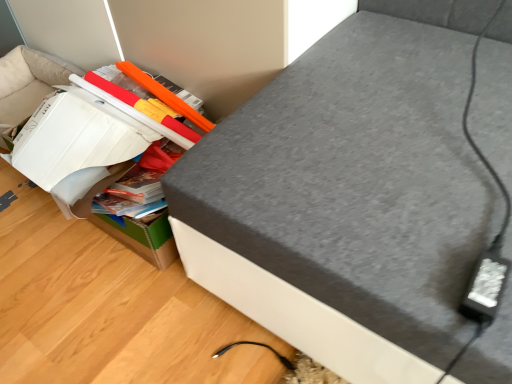
This screenshot has width=512, height=384. Find the location of `cardboard box at lower left`. cardboard box at lower left is located at coordinates (133, 225).

What do you see at coordinates (133, 225) in the screenshot? The image size is (512, 384). I see `cardboard box at lower left` at bounding box center [133, 225].

The image size is (512, 384). Describe the element at coordinates (350, 195) in the screenshot. I see `grey fabric ottoman at upper right` at that location.

Locate an element on the screen. This screenshot has height=384, width=512. grey fabric ottoman at upper right is located at coordinates (350, 195).

What is the approximate width of grey fabric ottoman at upper right?

It is 35.78 inches.

What are the coordinates of `cardboard box at lower left` in the screenshot? It's located at (133, 225).

Which is more to the right, cardboard box at lower left or grey fabric ottoman at upper right?

Positioned to the right is grey fabric ottoman at upper right.

Between cardboard box at lower left and grey fabric ottoman at upper right, which one is positioned behind?

Positioned behind is cardboard box at lower left.

Which is farther from the camera, (143,234) or (391,230)?

Point (143,234)

Consider the image. From the image's perspective, which is below, cardboard box at lower left or grey fabric ottoman at upper right?

cardboard box at lower left, from the image's perspective.

From a real-world perspective, is cardboard box at lower left above or below grey fabric ottoman at upper right?

From a real-world perspective, cardboard box at lower left is physically below grey fabric ottoman at upper right.

Does cardboard box at lower left have a greater width compared to grey fabric ottoman at upper right?

Incorrect, the width of cardboard box at lower left does not surpass that of grey fabric ottoman at upper right.

Does cardboard box at lower left have a lesser height compared to grey fabric ottoman at upper right?

Indeed, cardboard box at lower left has a lesser height compared to grey fabric ottoman at upper right.

Is cardboard box at lower left bigger than grey fabric ottoman at upper right?

Actually, cardboard box at lower left might be smaller than grey fabric ottoman at upper right.

Is grey fabric ottoman at upper right located within cardboard box at lower left?

No, grey fabric ottoman at upper right is not inside cardboard box at lower left.

Are cardboard box at lower left and grey fabric ottoman at upper right making contact?

No, cardboard box at lower left is not making contact with grey fabric ottoman at upper right.

Is grey fabric ottoman at upper right at the back of cardboard box at lower left?

No, cardboard box at lower left is not facing the opposite direction of grey fabric ottoman at upper right.

Image resolution: width=512 pixels, height=384 pixels. I want to click on cardboard box directly beneath the grey fabric ottoman at upper right (from a real-world perspective), so click(133, 225).

Looking at this image, does grey fabric ottoman at upper right appear on the right side of cardboard box at lower left?

Yes, grey fabric ottoman at upper right is to the right of cardboard box at lower left.

In the image, is grey fabric ottoman at upper right positioned in front of or behind cardboard box at lower left?

Clearly, grey fabric ottoman at upper right is in front of cardboard box at lower left.

Considering the points (281, 180) and (161, 211), which point is in front, point (281, 180) or point (161, 211)?

The point (281, 180) is closer to the camera.

From the image's perspective, relative to cardboard box at lower left, is grey fabric ottoman at upper right above or below?

Based on their image positions, grey fabric ottoman at upper right is located above cardboard box at lower left.

From a real-world perspective, who is located higher, grey fabric ottoman at upper right or cardboard box at lower left?

From a 3D spatial view, grey fabric ottoman at upper right is above.

Based on the photo, considering the relative sizes of grey fabric ottoman at upper right and cardboard box at lower left in the image provided, is grey fabric ottoman at upper right thinner than cardboard box at lower left?

In fact, grey fabric ottoman at upper right might be wider than cardboard box at lower left.

Which of these two, grey fabric ottoman at upper right or cardboard box at lower left, stands taller?

grey fabric ottoman at upper right is taller.

Which of these two, grey fabric ottoman at upper right or cardboard box at lower left, is smaller?

cardboard box at lower left is smaller.

Would you say grey fabric ottoman at upper right contains cardboard box at lower left?

No, cardboard box at lower left is not surrounded by grey fabric ottoman at upper right.

Is the surface of grey fabric ottoman at upper right in direct contact with cardboard box at lower left?

They are not placed beside each other.

Does grey fabric ottoman at upper right turn towards cardboard box at lower left?

No, grey fabric ottoman at upper right is not turned towards cardboard box at lower left.

Can you tell me how much grey fabric ottoman at upper right and cardboard box at lower left differ in facing direction?

The angular difference between grey fabric ottoman at upper right and cardboard box at lower left is 1.15 degrees.

At what (x,y) coordinates should I click in order to perform the action: click on cardboard box that is behind the grey fabric ottoman at upper right. Please return your answer as a coordinate pair (x, y). Image resolution: width=512 pixels, height=384 pixels. Looking at the image, I should click on (133, 225).

The width and height of the screenshot is (512, 384). Find the location of `furniture above the cardboard box at lower left (from the image's perspective)`. furniture above the cardboard box at lower left (from the image's perspective) is located at coordinates [350, 195].

Locate an element on the screen. The width and height of the screenshot is (512, 384). cardboard box on the left of grey fabric ottoman at upper right is located at coordinates (133, 225).